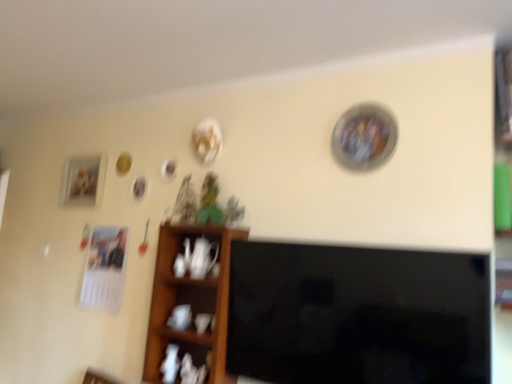
Question: Is wooden shelf at center shorter than black glossy tv at center?

Choices:
 (A) no
 (B) yes

Answer: (A)

Question: Is wooden shelf at center next to black glossy tv at center and touching it?

Choices:
 (A) no
 (B) yes

Answer: (A)

Question: Is wooden shelf at center aimed at black glossy tv at center?

Choices:
 (A) no
 (B) yes

Answer: (A)

Question: Does wooden shelf at center come behind black glossy tv at center?

Choices:
 (A) yes
 (B) no

Answer: (A)

Question: From the image's perspective, is wooden shelf at center under black glossy tv at center?

Choices:
 (A) yes
 (B) no

Answer: (A)

Question: From the image's perspective, is matte wooden picture frame at left located above or below black glossy tv at center?

Choices:
 (A) above
 (B) below

Answer: (A)

Question: Is matte wooden picture frame at left to the left or to the right of black glossy tv at center in the image?

Choices:
 (A) right
 (B) left

Answer: (B)

Question: In the image, is matte wooden picture frame at left positioned in front of or behind black glossy tv at center?

Choices:
 (A) behind
 (B) front

Answer: (A)

Question: Is matte wooden picture frame at left spatially inside black glossy tv at center, or outside of it?

Choices:
 (A) inside
 (B) outside

Answer: (B)

Question: Considering the positions of black glossy tv at center and wooden shelf at center in the image, is black glossy tv at center taller or shorter than wooden shelf at center?

Choices:
 (A) tall
 (B) short

Answer: (B)

Question: Is point (435, 375) positioned closer to the camera than point (150, 365)?

Choices:
 (A) closer
 (B) farther

Answer: (A)

Question: Considering their positions, is black glossy tv at center located in front of or behind wooden shelf at center?

Choices:
 (A) front
 (B) behind

Answer: (A)

Question: Is black glossy tv at center wider or thinner than wooden shelf at center?

Choices:
 (A) thin
 (B) wide

Answer: (A)

Question: Considering the positions of point (348, 306) and point (105, 155), is point (348, 306) closer or farther from the camera than point (105, 155)?

Choices:
 (A) farther
 (B) closer

Answer: (B)

Question: In the image, is black glossy tv at center on the left side or the right side of matte wooden picture frame at left?

Choices:
 (A) left
 (B) right

Answer: (B)